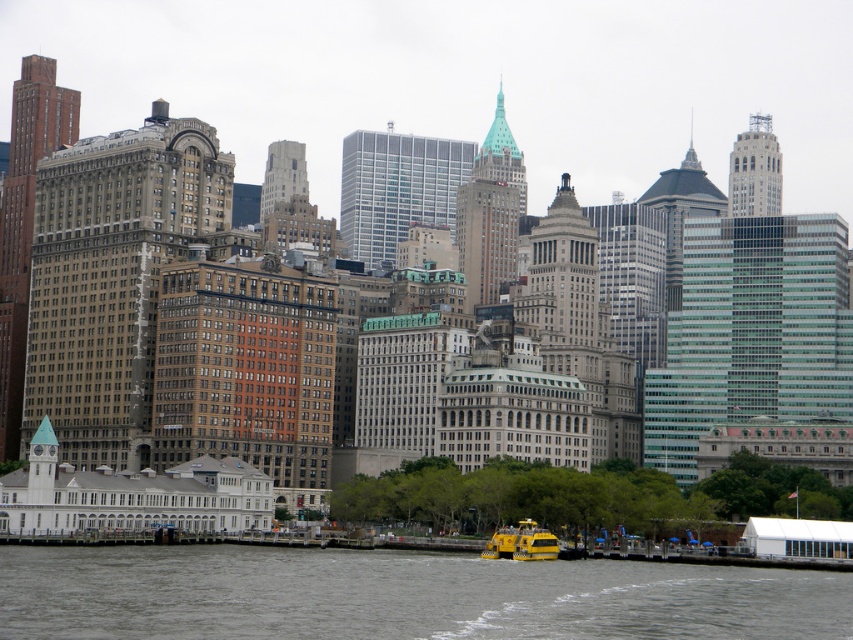
Question: Which point appears farthest from the camera in this image?

Choices:
 (A) (508, 536)
 (B) (469, 577)

Answer: (A)

Question: Which of the following is the farthest from the observer?

Choices:
 (A) yellow rubber boat at lower center
 (B) gray water at lower center

Answer: (A)

Question: Can you confirm if gray water at lower center is positioned to the right of yellow rubber boat at lower center?

Choices:
 (A) yes
 (B) no

Answer: (B)

Question: Which of the following is the farthest from the observer?

Choices:
 (A) yellow rubber boat at lower center
 (B) gray water at lower center

Answer: (A)

Question: Can you confirm if gray water at lower center is positioned below yellow rubber boat at lower center?

Choices:
 (A) no
 (B) yes

Answer: (A)

Question: Does gray water at lower center have a lesser width compared to yellow rubber boat at lower center?

Choices:
 (A) no
 (B) yes

Answer: (A)